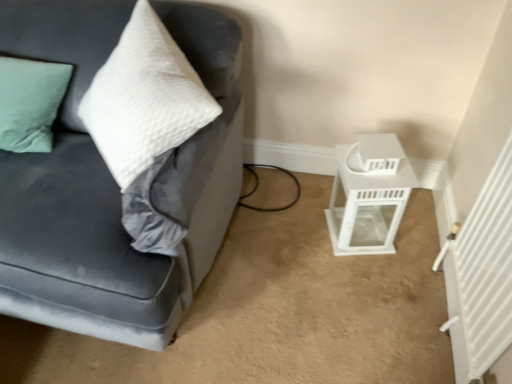
The image size is (512, 384). In order to click on vacant space situated on the left part of white glossy lantern at lower right in this screenshot , I will do `click(296, 232)`.